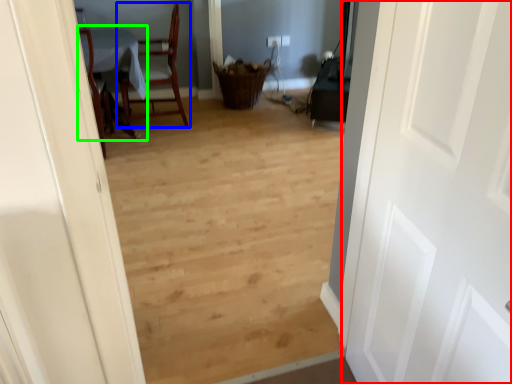
Question: Considering the real-world distances, which object is farthest from door (highlighted by a red box)? chair (highlighted by a blue box) or table (highlighted by a green box)?

Choices:
 (A) chair
 (B) table

Answer: (A)